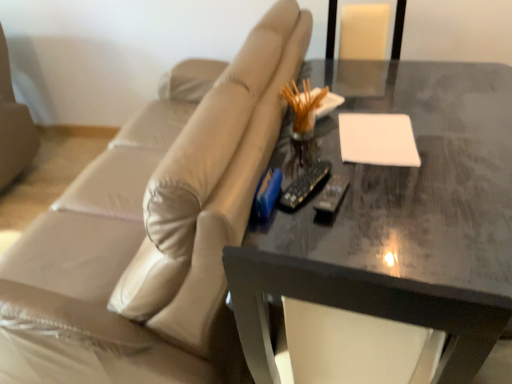
Identify the location of free space to the back side of black plastic remote at center. (304, 155).